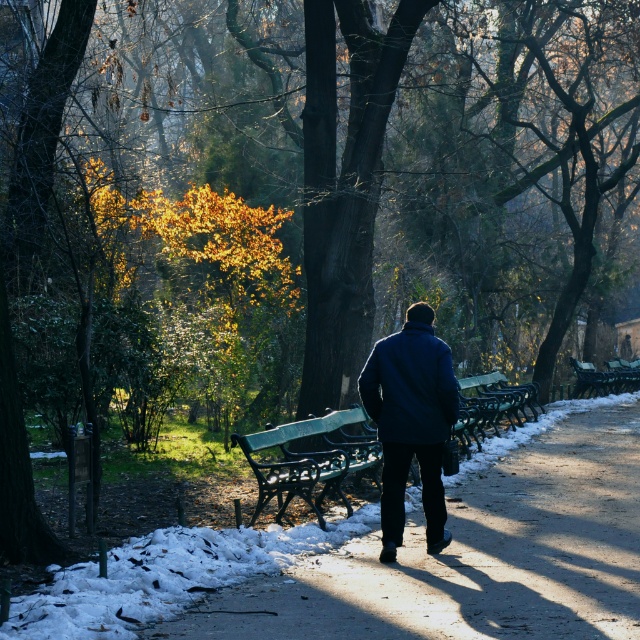
You are standing at the point labeled point (563, 624) and want to walk towards the point labeled point (416, 372). Which direction should you face to move towards it?

You should face away from the viewer because point (416, 372) is further away from the viewer than point (563, 624).

You are a person carrying a dark blue coat at center and want to place it on the green wooden bench at center. Is there enough space between them for you to do so?

The green wooden bench at center and dark blue coat at center are 5.88 feet apart, so yes, there is enough space between them for you to place the dark blue coat at center on the green wooden bench at center.